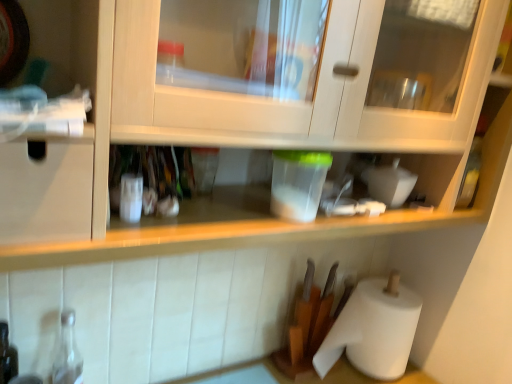
Question: From a real-world perspective, is white paper at lower right positioned above or below transparent glass bottle at lower left?

Choices:
 (A) above
 (B) below

Answer: (A)

Question: Relative to transparent glass bottle at lower left, is white paper at lower right in front or behind?

Choices:
 (A) front
 (B) behind

Answer: (B)

Question: Looking at the image, does white paper at lower right seem bigger or smaller compared to transparent glass bottle at lower left?

Choices:
 (A) small
 (B) big

Answer: (B)

Question: Based on their sizes in the image, would you say transparent glass bottle at lower left is bigger or smaller than white paper at lower right?

Choices:
 (A) small
 (B) big

Answer: (A)

Question: Which is correct: transparent glass bottle at lower left is inside white paper at lower right, or outside of it?

Choices:
 (A) inside
 (B) outside

Answer: (B)

Question: Considering the relative positions of transparent glass bottle at lower left and white paper at lower right in the image provided, is transparent glass bottle at lower left to the left or to the right of white paper at lower right?

Choices:
 (A) right
 (B) left

Answer: (B)

Question: Is transparent glass bottle at lower left in front of or behind white paper at lower right in the image?

Choices:
 (A) front
 (B) behind

Answer: (A)